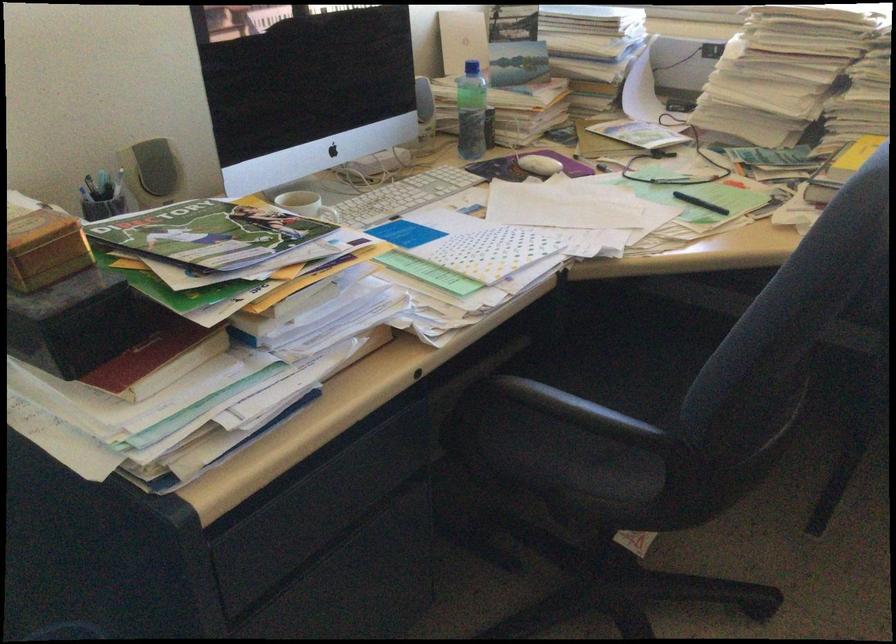
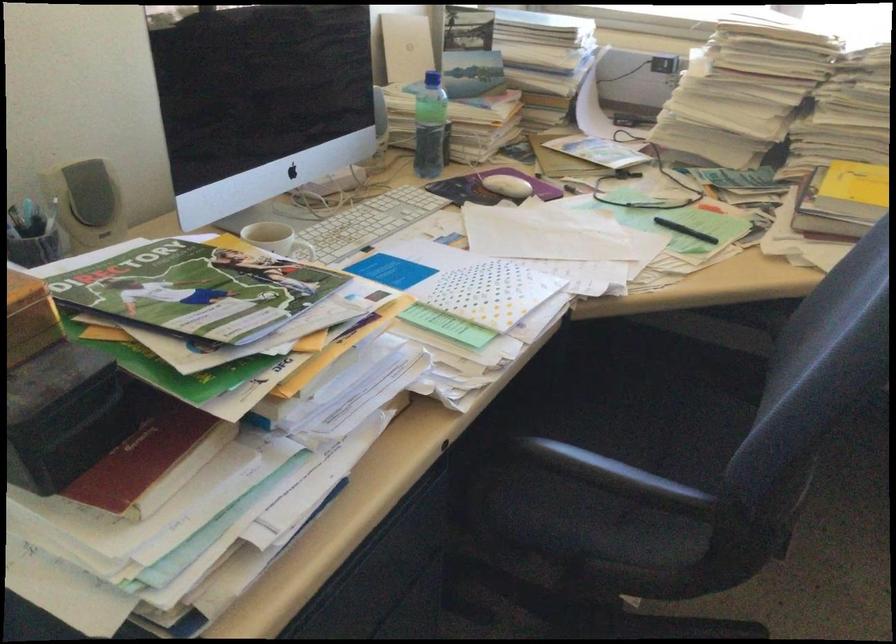
In the second image, find the point that corresponds to point (469, 111) in the first image.

(428, 126)